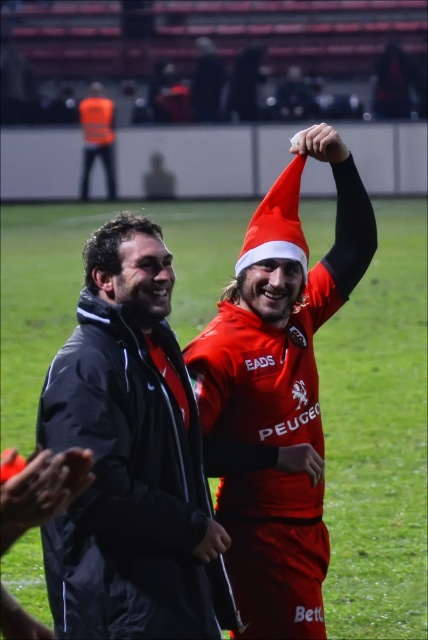
What do you see at coordinates (127, 449) in the screenshot? This screenshot has height=640, width=428. I see `dark gray jacket at left` at bounding box center [127, 449].

Which is in front, point (118, 467) or point (86, 152)?

Point (118, 467) is more forward.

Find the location of a particular element. Image resolution: width=428 pixels, height=640 pixels. dark gray jacket at left is located at coordinates (127, 449).

Is point (140, 564) positioned before point (216, 554)?

Yes, point (140, 564) is closer to viewer.

This screenshot has width=428, height=640. What are the coordinates of `black matte jacket at center` in the screenshot? It's located at (128, 458).

Can you confirm if orange reflective vest at upper left is bigger than matte black hand at center?

Yes.

Based on the photo, who is taller, orange reflective vest at upper left or matte black hand at center?

orange reflective vest at upper left

Describe the element at coordinates (97, 138) in the screenshot. I see `orange reflective vest at upper left` at that location.

Find the location of `orange reflective vest at upper left`. orange reflective vest at upper left is located at coordinates [x=97, y=138].